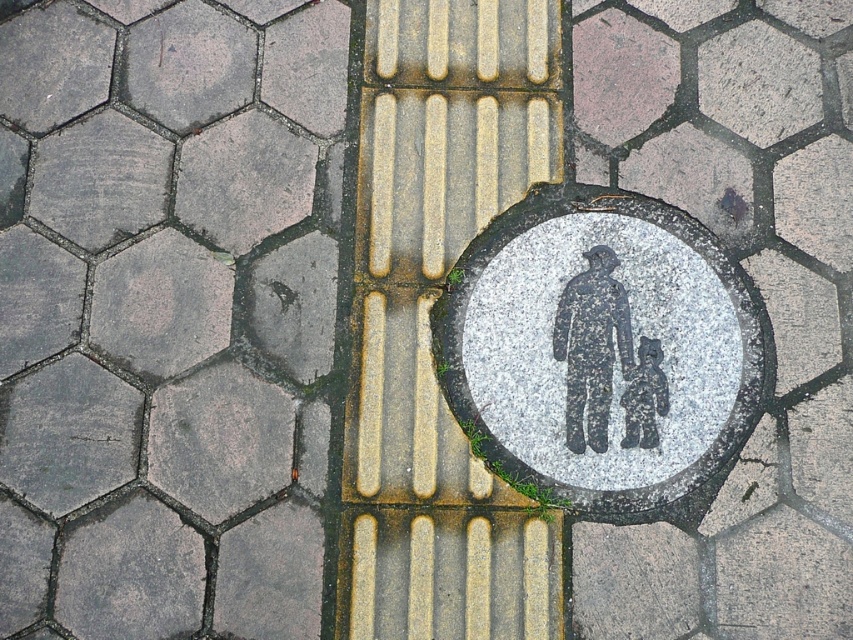
Question: Does granite circle at center have a lesser width compared to black textured figure at center?

Choices:
 (A) no
 (B) yes

Answer: (A)

Question: Does black textured figure at center appear over dark gray stone figure at center?

Choices:
 (A) no
 (B) yes

Answer: (B)

Question: Can you confirm if black textured figure at center is positioned above dark gray stone figure at center?

Choices:
 (A) yes
 (B) no

Answer: (A)

Question: Which object is closer to the camera taking this photo?

Choices:
 (A) dark gray stone figure at center
 (B) granite circle at center
 (C) black textured figure at center

Answer: (B)

Question: Estimate the real-world distances between objects in this image. Which object is closer to the black textured figure at center?

Choices:
 (A) dark gray stone figure at center
 (B) granite circle at center

Answer: (A)

Question: Which point is closer to the camera?

Choices:
 (A) black textured figure at center
 (B) granite circle at center
 (C) dark gray stone figure at center

Answer: (B)